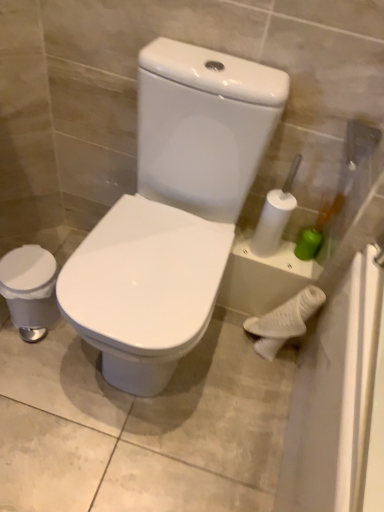
You are a GUI agent. You are given a task and a screenshot of the screen. Output one action in this format:
    pyautogui.click(x=<x>, y=<y>)
    Task: Click on the vacant space that is in between white glossy toilet at center, placed as the second porcelain when sorted from left to right, and white matte porcelain at lower right, acting as the 1th porcelain starting from the right
    Image resolution: width=384 pixels, height=512 pixels.
    Given the screenshot: What is the action you would take?
    pyautogui.click(x=224, y=362)